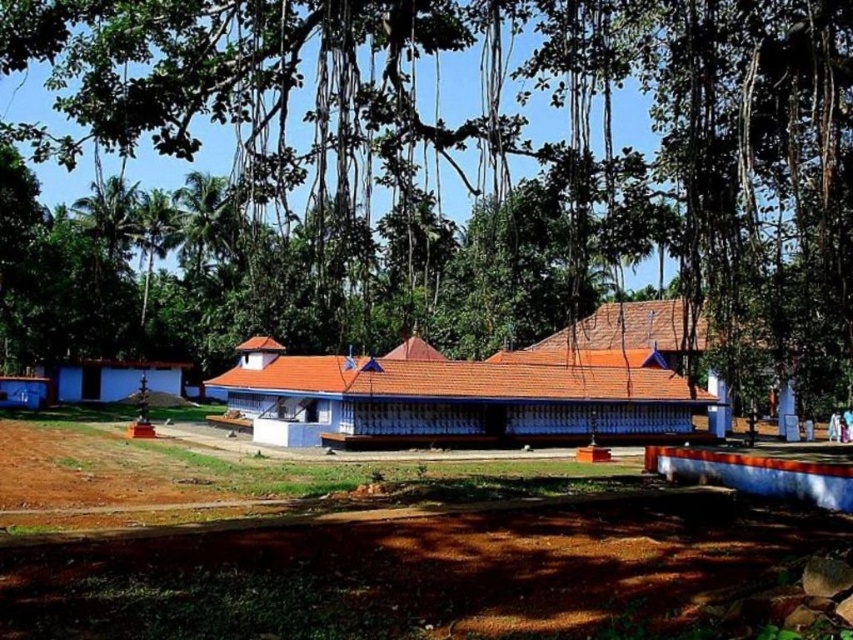
Which is in front, point (585, 620) or point (680, 378)?

Point (585, 620) is in front.

Does brown soil at lower center have a greater height compared to white painted wood temple at center?

Incorrect, brown soil at lower center's height is not larger of white painted wood temple at center's.

Identify the location of brown soil at lower center. (367, 547).

Is brown soil at lower center shorter than blue painted wood hut at left?

Incorrect, brown soil at lower center's height does not fall short of blue painted wood hut at left's.

Can you confirm if brown soil at lower center is positioned to the right of blue painted wood hut at left?

Yes, brown soil at lower center is to the right of blue painted wood hut at left.

Is point (791, 524) positioned in front of point (68, 365)?

Yes, point (791, 524) is in front of point (68, 365).

The image size is (853, 640). In order to click on brown soil at lower center in this screenshot , I will do `click(367, 547)`.

Looking at this image, is the position of green leafy tree at upper center less distant than that of white painted wood temple at center?

Yes, it is in front of white painted wood temple at center.

Is green leafy tree at upper center above white painted wood temple at center?

Yes, green leafy tree at upper center is above white painted wood temple at center.

The width and height of the screenshot is (853, 640). Find the location of `green leafy tree at upper center`. green leafy tree at upper center is located at coordinates (496, 154).